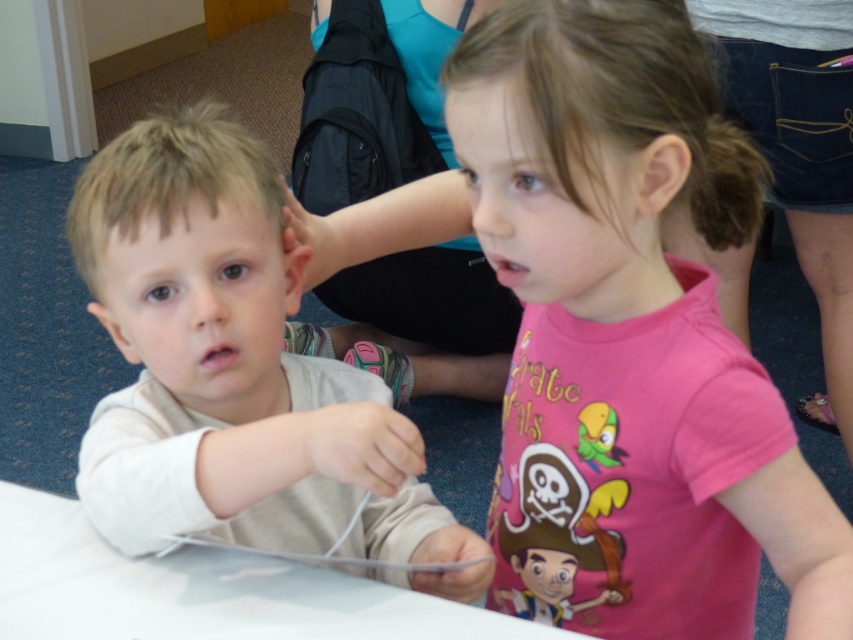
Which is in front, point (776, 419) or point (219, 161)?

Point (776, 419) is more forward.

Does pink cotton shirt at center have a lesser width compared to light beige shirt at left?

In fact, pink cotton shirt at center might be wider than light beige shirt at left.

Describe the element at coordinates (633, 298) in the screenshot. I see `pink cotton shirt at center` at that location.

In order to click on pink cotton shirt at center in this screenshot , I will do `click(633, 298)`.